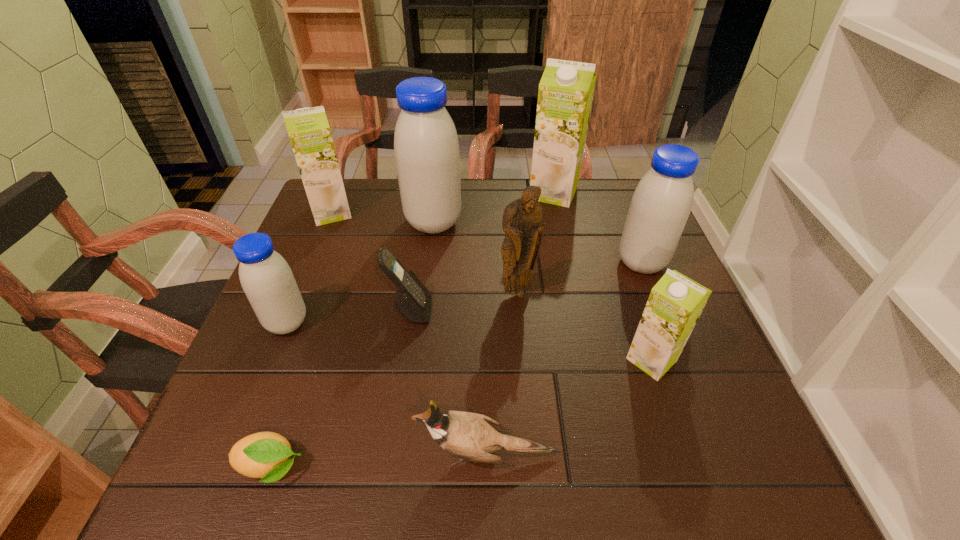
Where is `empty space that is in between the nearest blue soya milk and the biggest blue soya milk`? This screenshot has width=960, height=540. empty space that is in between the nearest blue soya milk and the biggest blue soya milk is located at coordinates (360, 273).

Where is `vacant region between the nearest green soya milk and the nearest blue soya milk`? vacant region between the nearest green soya milk and the nearest blue soya milk is located at coordinates (469, 341).

At what (x,y) coordinates should I click in order to perform the action: click on free space between the yellow lemon and the cellular telephone. Please return your answer as a coordinate pair (x, y). The image size is (960, 540). Looking at the image, I should click on (341, 389).

The image size is (960, 540). In order to click on free space between the biggest green soya milk and the lemon in this screenshot , I will do `click(412, 330)`.

Identify the location of the eighth closest object to the rightmost blue soya milk. click(x=266, y=278).

Identify the location of the seventh closest object to the figurine. (266, 278).

This screenshot has width=960, height=540. Identify the location of the fifth closest soya milk to the bird. (308, 129).

Point out which soya milk is positioned as the nearest to the smallest blue soya milk. Please provide its 2D coordinates. Your answer should be formatted as a tuple, i.e. [(x, y)], where the tuple contains the x and y coordinates of a point satisfying the conditions above.

[(426, 147)]

Point out which green soya milk is positioned as the third nearest to the farthest blue soya milk. Please provide its 2D coordinates. Your answer should be formatted as a tuple, i.e. [(x, y)], where the tuple contains the x and y coordinates of a point satisfying the conditions above.

[(675, 303)]

Select which green soya milk appears as the third closest to the leftmost blue soya milk. Please provide its 2D coordinates. Your answer should be formatted as a tuple, i.e. [(x, y)], where the tuple contains the x and y coordinates of a point satisfying the conditions above.

[(675, 303)]